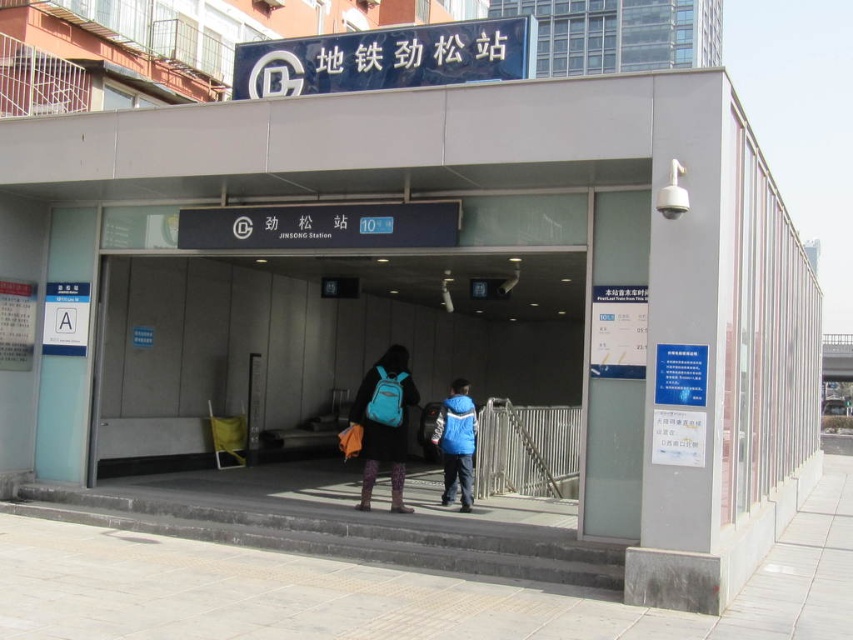
You are standing at the entrance of Jingsong Subway Station. You see a matte blue backpack at center. Can you pick it up without moving from your current position?

The matte blue backpack at center is 8.30 meters away from viewer, so you cannot reach it without moving closer.